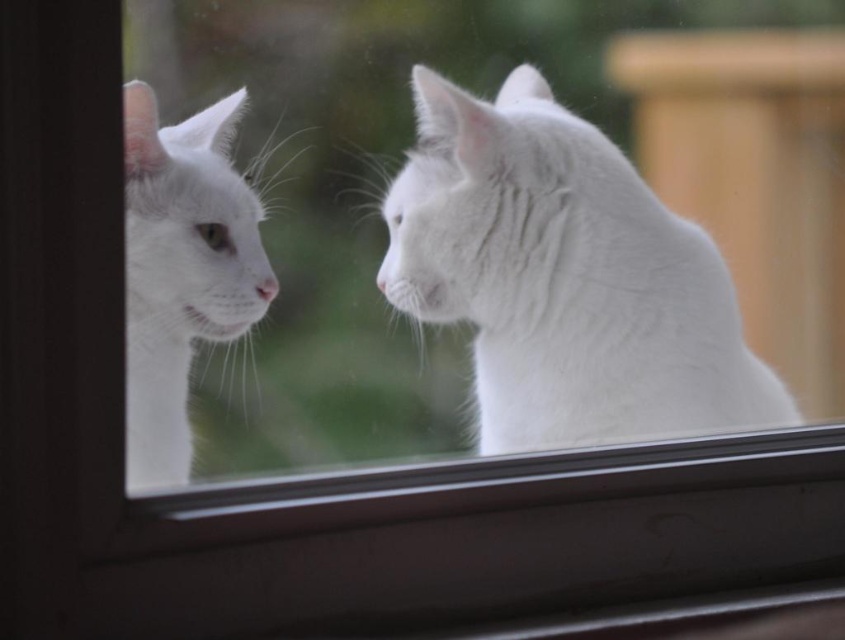
Question: Which of the following is the closest to the observer?

Choices:
 (A) (563, 362)
 (B) (178, 360)

Answer: (A)

Question: Does white fluffy cat at center appear on the right side of white fluffy cat at left?

Choices:
 (A) no
 (B) yes

Answer: (B)

Question: Can you confirm if white fluffy cat at center is thinner than white fluffy cat at left?

Choices:
 (A) no
 (B) yes

Answer: (A)

Question: Is white fluffy cat at center to the left of white fluffy cat at left from the viewer's perspective?

Choices:
 (A) yes
 (B) no

Answer: (B)